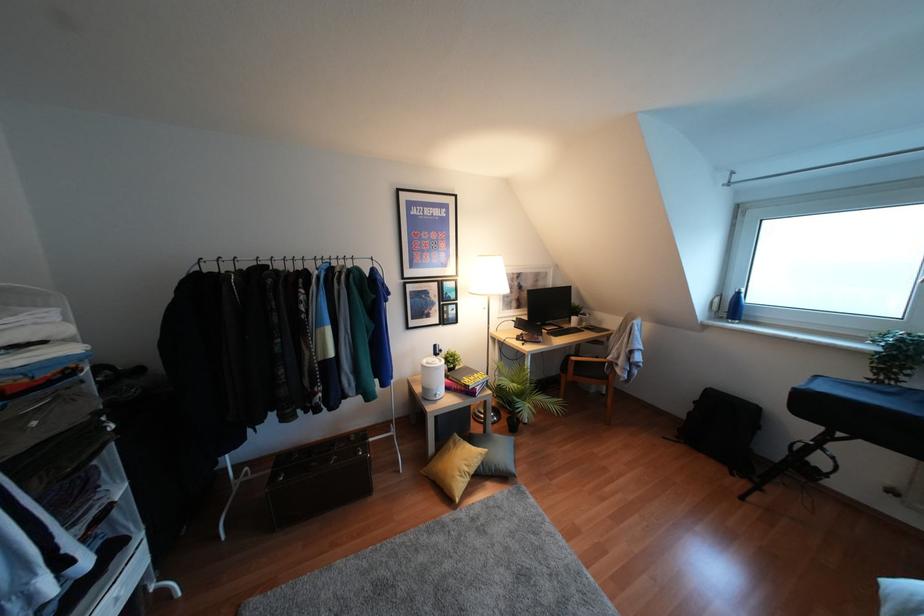
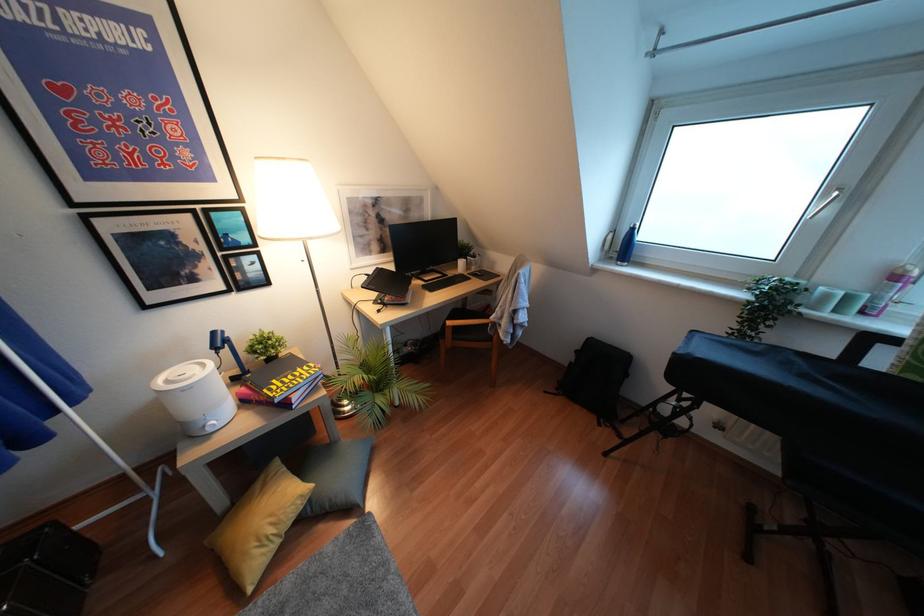
In the second image, find the point that corresponds to point 732,308 in the first image.

(623, 246)